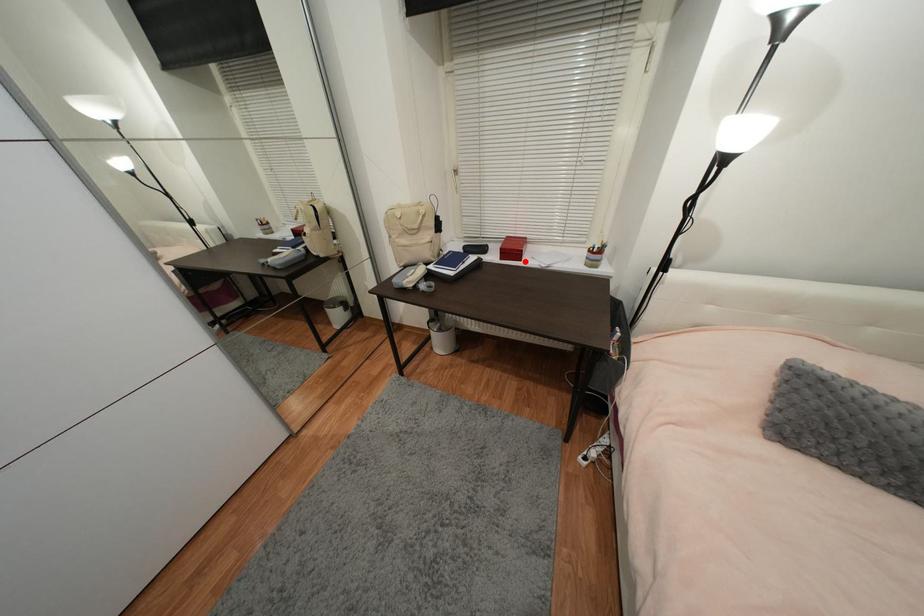
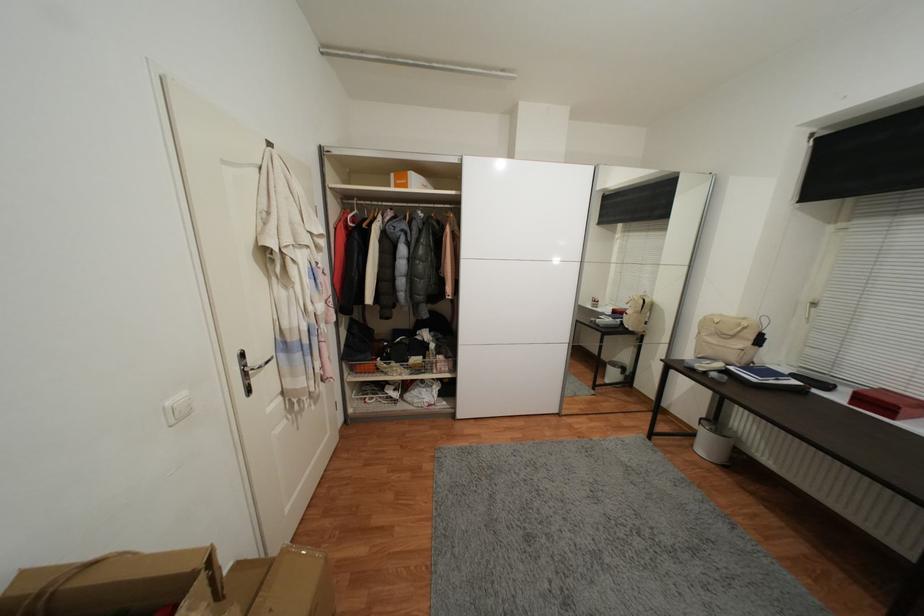
Question: I am providing you with two images of the same scene from different viewpoints. In image1, a red point is highlighted. Considering the same 3D point in image2, which of the following is correct?

Choices:
 (A) It is closer
 (B) It is farther

Answer: (B)